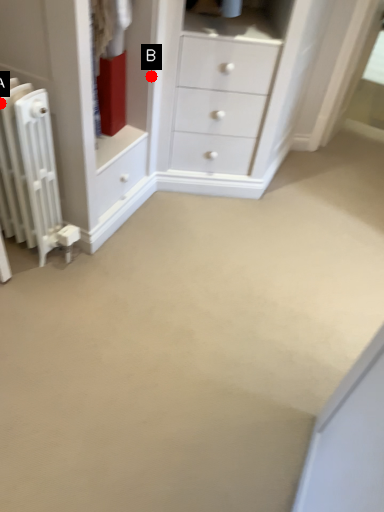
Question: Two points are circled on the image, labeled by A and B beside each circle. Which point is closer to the camera taking this photo?

Choices:
 (A) A is closer
 (B) B is closer

Answer: (A)